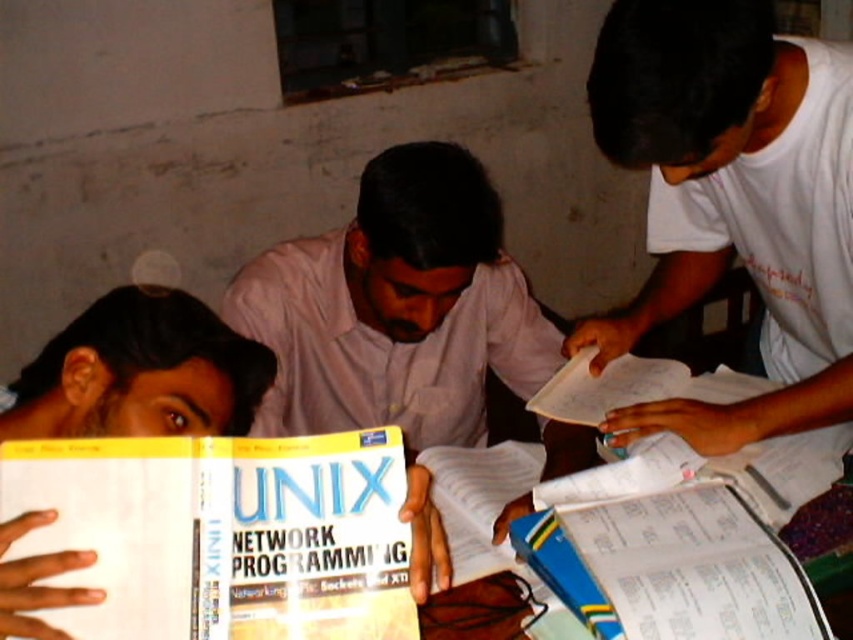
Who is positioned more to the left, light pink cotton shirt at center or white paper notebook at lower right?

From the viewer's perspective, light pink cotton shirt at center appears more on the left side.

In the scene shown: Does light pink cotton shirt at center have a lesser width compared to white paper notebook at lower right?

No.

Which is in front, point (300, 374) or point (772, 620)?

Point (772, 620) is in front.

In order to click on light pink cotton shirt at center in this screenshot , I will do `click(397, 308)`.

Is white matte shirt at upper right closer to the viewer compared to white paper notebook at lower right?

No, it is behind white paper notebook at lower right.

Is white matte shirt at upper right to the left of white paper notebook at lower right from the viewer's perspective?

No, white matte shirt at upper right is not to the left of white paper notebook at lower right.

I want to click on white matte shirt at upper right, so click(730, 200).

The width and height of the screenshot is (853, 640). What are the coordinates of `white matte shirt at upper right` in the screenshot? It's located at (730, 200).

Does white matte shirt at upper right have a larger size compared to yellow paperback book at center?

Yes.

Who is more forward, (786, 218) or (22, 477)?

Point (22, 477) is more forward.

Is point (810, 132) positioned before point (125, 513)?

No, (810, 132) is behind (125, 513).

This screenshot has width=853, height=640. Find the location of `white matte shirt at upper right`. white matte shirt at upper right is located at coordinates (730, 200).